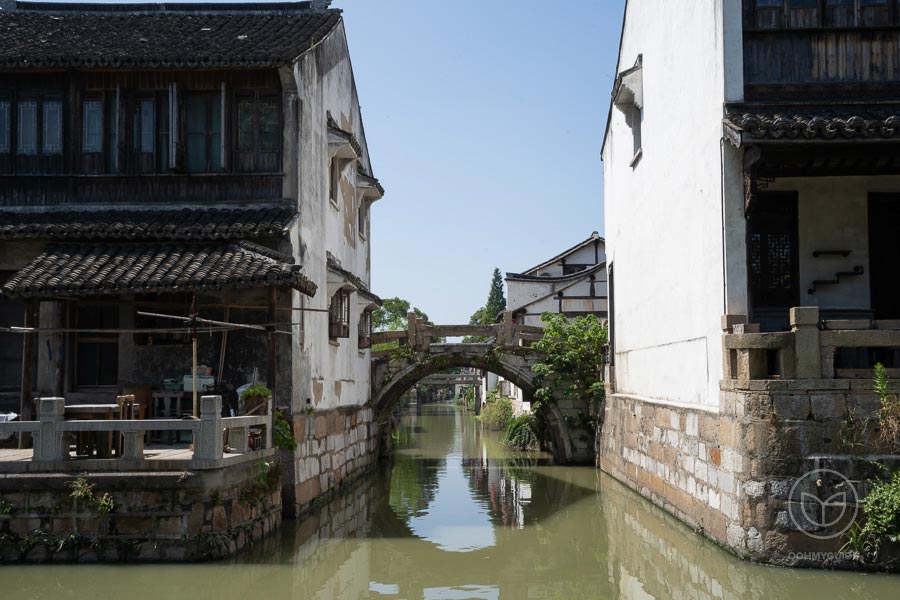
What are the coordinates of `window` in the screenshot? It's located at (627, 93), (338, 184), (367, 203), (334, 309), (364, 322).